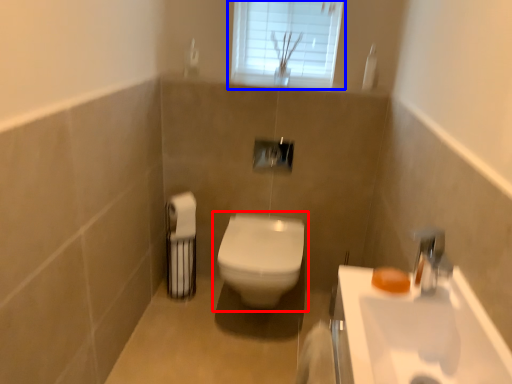
Question: Which of the following is the closest to the observer, toilet (highlighted by a red box) or window (highlighted by a blue box)?

Choices:
 (A) toilet
 (B) window

Answer: (A)